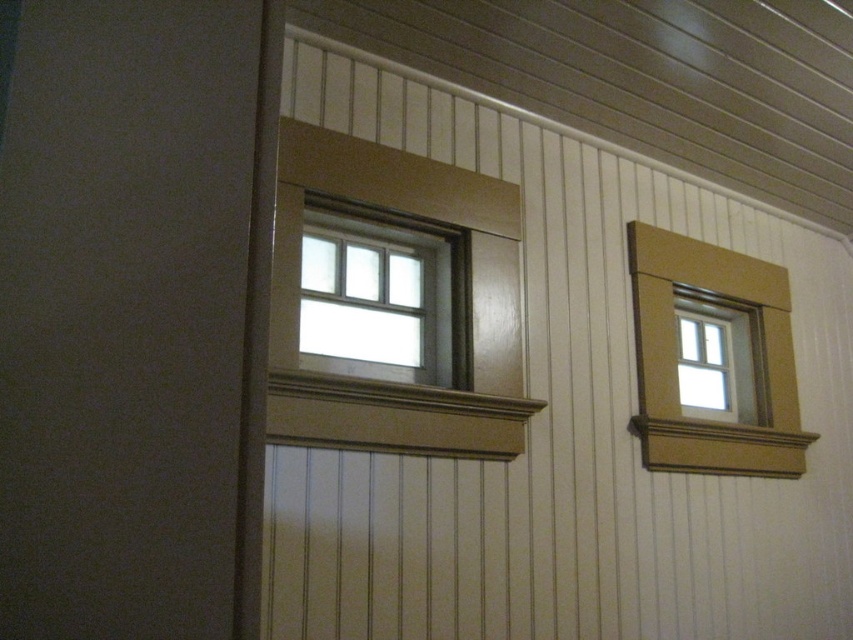
Consider the image. You are an interior designer assessing the wall with the matte brown siding at left and the matte glass window at upper center. Which object occupies more vertical space on the wall?

The matte glass window at upper center occupies more vertical space than the matte brown siding at left because the matte brown siding at left has a lesser height compared to matte glass window at upper center.

You are an interior designer planning to hang a picture frame that measures 20 cm in width. You need to place it precisely at the point specified in the scene. The wooden siding at upper left is located at point (566, 426). Can you confirm if the wooden siding at upper left is the correct location for the frame?

The wooden siding at upper left is located at point (566, 426), so yes, this is the correct location to place the picture frame there.